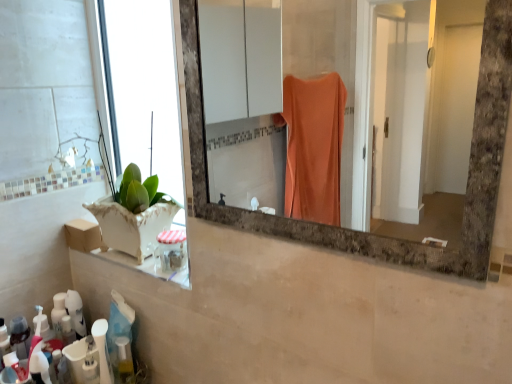
Question: Is marble frame mirror at center far from white glossy lotion at lower left, which appears as the third toiletry when viewed from the right?

Choices:
 (A) yes
 (B) no

Answer: (A)

Question: Considering the relative sizes of marble frame mirror at center and white glossy lotion at lower left, placed as the 3th toiletry when sorted from top to bottom, in the image provided, is marble frame mirror at center bigger than white glossy lotion at lower left, placed as the 3th toiletry when sorted from top to bottom,?

Choices:
 (A) yes
 (B) no

Answer: (A)

Question: Is marble frame mirror at center to the left of white glossy lotion at lower left, which appears as the third toiletry when viewed from the right, from the viewer's perspective?

Choices:
 (A) no
 (B) yes

Answer: (A)

Question: Considering the relative positions of marble frame mirror at center and white glossy lotion at lower left, placed as the 3th toiletry when sorted from top to bottom, in the image provided, is marble frame mirror at center to the right of white glossy lotion at lower left, placed as the 3th toiletry when sorted from top to bottom, from the viewer's perspective?

Choices:
 (A) yes
 (B) no

Answer: (A)

Question: Does marble frame mirror at center turn towards white glossy lotion at lower left, placed as the 3th toiletry when sorted from top to bottom?

Choices:
 (A) yes
 (B) no

Answer: (B)

Question: Considering the positions of marble frame mirror at center and green leafy plant at left in the image, is marble frame mirror at center bigger or smaller than green leafy plant at left?

Choices:
 (A) big
 (B) small

Answer: (B)

Question: Considering the relative positions of marble frame mirror at center and green leafy plant at left in the image provided, is marble frame mirror at center to the left or to the right of green leafy plant at left?

Choices:
 (A) right
 (B) left

Answer: (A)

Question: Looking at their shapes, would you say marble frame mirror at center is wider or thinner than green leafy plant at left?

Choices:
 (A) wide
 (B) thin

Answer: (B)

Question: Is marble frame mirror at center spatially inside green leafy plant at left, or outside of it?

Choices:
 (A) inside
 (B) outside

Answer: (B)

Question: Would you say white glossy lotion at lower left, which is the 2th toiletry from left to right, is inside or outside white plastic bottle at lower left, placed as the 2th toiletry when sorted from top to bottom?

Choices:
 (A) inside
 (B) outside

Answer: (B)

Question: Is white glossy lotion at lower left, which is the 2th toiletry from left to right, bigger or smaller than white plastic bottle at lower left, acting as the second toiletry starting from the right?

Choices:
 (A) big
 (B) small

Answer: (B)

Question: Does point (90, 342) appear closer or farther from the camera than point (103, 372)?

Choices:
 (A) farther
 (B) closer

Answer: (A)

Question: From the image's perspective, relative to white plastic bottle at lower left, acting as the second toiletry starting from the right, is white glossy lotion at lower left, arranged as the 2th toiletry when ordered from the bottom, above or below?

Choices:
 (A) below
 (B) above

Answer: (A)

Question: Relative to marble frame mirror at center, is white glossy lotion at lower left, which appears as the third toiletry when viewed from the right, in front or behind?

Choices:
 (A) behind
 (B) front

Answer: (A)

Question: Does point (90, 367) appear closer or farther from the camera than point (399, 208)?

Choices:
 (A) closer
 (B) farther

Answer: (A)